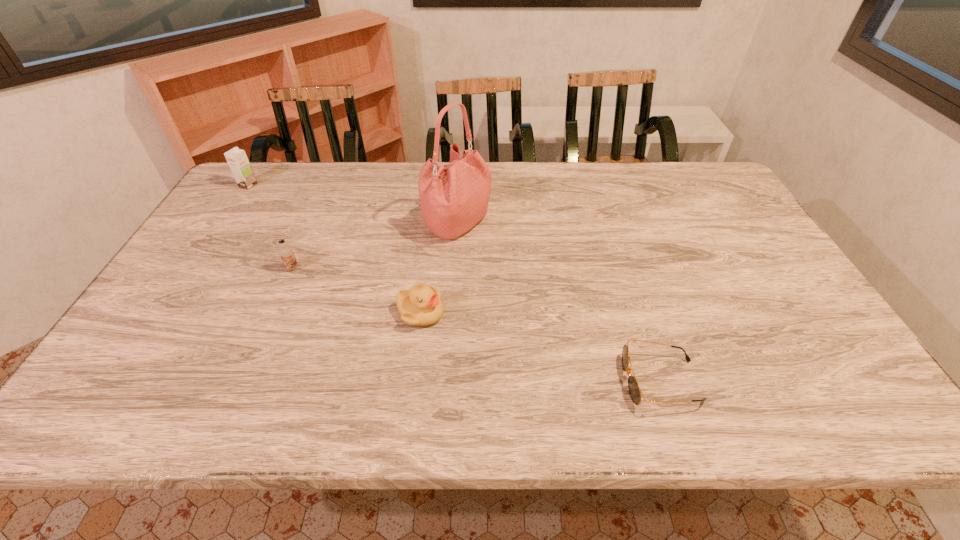
This screenshot has height=540, width=960. I want to click on free space at the far edge, so click(631, 190).

In order to click on blank space at the near edge of the desktop in this screenshot , I will do point(519,410).

The image size is (960, 540). Identify the location of vacant space at the left edge of the desktop. (219, 281).

Identify the location of vacant space at the right edge of the desktop. (729, 264).

Identify the location of vacant space at the near left corner of the desktop. click(143, 395).

Identify the location of vacant area at the near right corner. The width and height of the screenshot is (960, 540). (840, 406).

The image size is (960, 540). In order to click on empty location between the left chocolate milk and the second farthest object in this screenshot , I will do `click(352, 204)`.

Locate an element on the screen. The width and height of the screenshot is (960, 540). vacant area that lies between the rightmost object and the fourth nearest object is located at coordinates (559, 302).

Identify the location of vacant area between the duckling and the rightmost object. The image size is (960, 540). (540, 347).

Find the location of `vacant area that lies between the farther chocolate milk and the third farthest object`. vacant area that lies between the farther chocolate milk and the third farthest object is located at coordinates (271, 227).